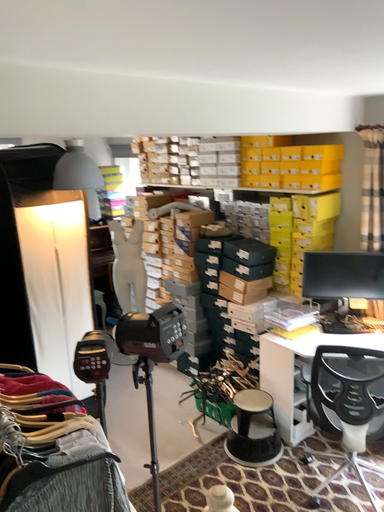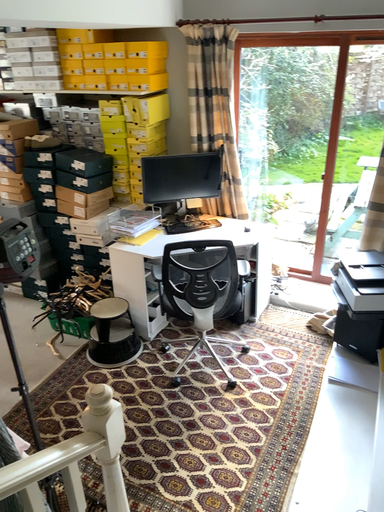
Question: How did the camera likely rotate when shooting the video?

Choices:
 (A) rotated downward
 (B) rotated upward

Answer: (A)